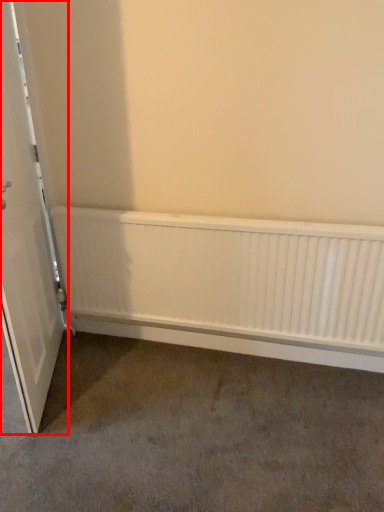
Question: Considering the relative positions of door (annotated by the red box) and radiator in the image provided, where is door (annotated by the red box) located with respect to the staircase?

Choices:
 (A) right
 (B) left

Answer: (B)